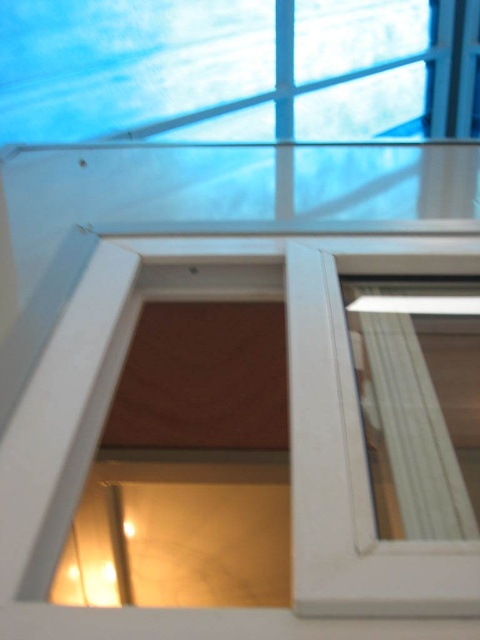
Between white matte window frame at center and clear glass window at center, which one has more height?

white matte window frame at center

Can you confirm if white matte window frame at center is positioned above clear glass window at center?

Yes.

Is point (99, 419) behind point (440, 401)?

That is False.

Identify the location of white matte window frame at center. (289, 413).